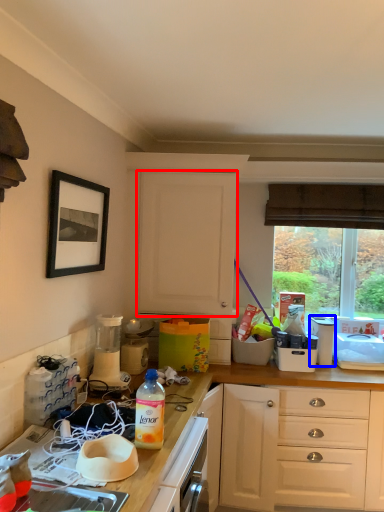
Question: Which object is closer to the camera taking this photo, cabinetry (highlighted by a red box) or appliance (highlighted by a blue box)?

Choices:
 (A) cabinetry
 (B) appliance

Answer: (A)